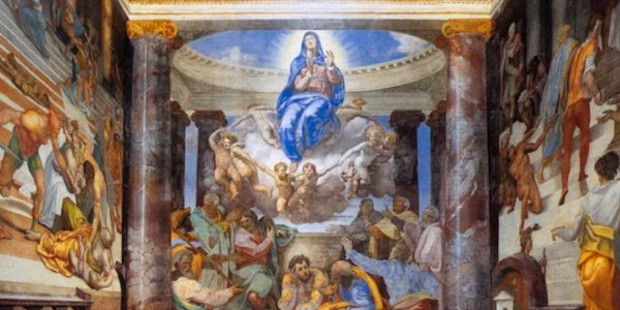
Locate an element on the screen. The image size is (620, 310). painting is located at coordinates (330, 168).